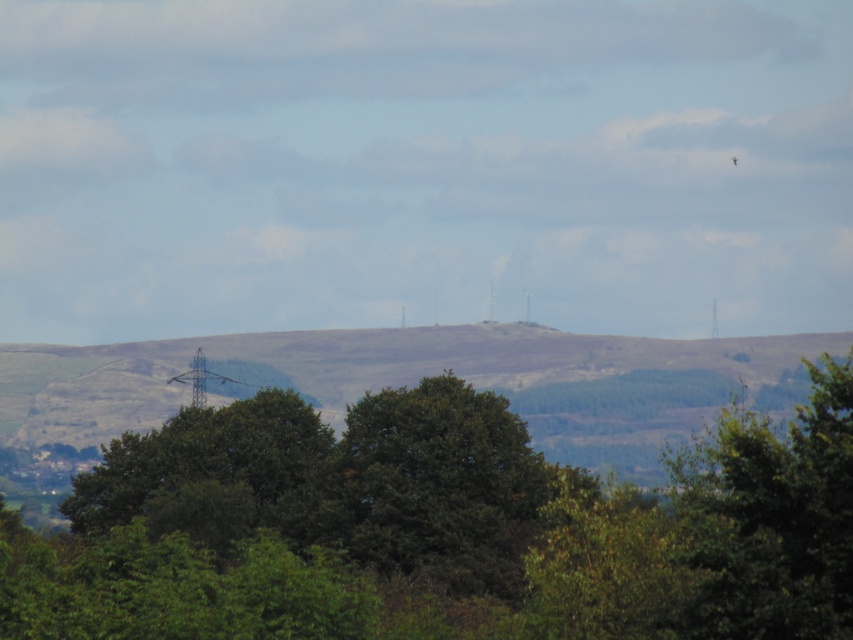
Who is shorter, green leafy tree at center or green grassy hillside at center?

green leafy tree at center is shorter.

Who is more forward, (361, 579) or (706, 412)?

Point (361, 579) is more forward.

In order to click on green leafy tree at center in this screenshot , I will do `click(440, 529)`.